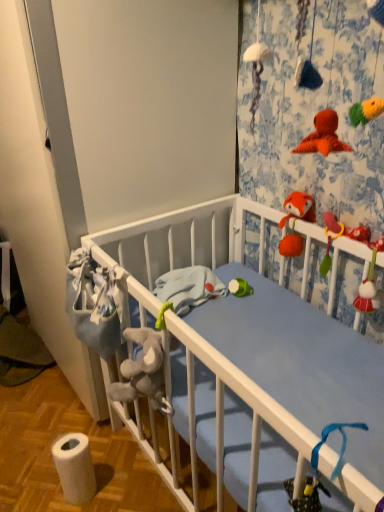
Describe the element at coordinates (298, 208) in the screenshot. Image resolution: width=384 pixels, height=512 pixels. I see `fluffy orange fox at upper right` at that location.

Where is `fluffy orange fox at upper right`? This screenshot has height=512, width=384. fluffy orange fox at upper right is located at coordinates (298, 208).

What do you see at coordinates (74, 467) in the screenshot? I see `white matte toilet paper at lower left` at bounding box center [74, 467].

This screenshot has width=384, height=512. Identify the location of white matte toilet paper at lower left. (74, 467).

Locate an element on the screen. This screenshot has height=512, width=384. fluffy orange fox at upper right is located at coordinates (298, 208).

Considering the relative positions of white matte toilet paper at lower left and fluffy orange fox at upper right in the image provided, is white matte toilet paper at lower left to the left or to the right of fluffy orange fox at upper right?

In the image, white matte toilet paper at lower left appears on the left side of fluffy orange fox at upper right.

Considering their positions, is white matte toilet paper at lower left located in front of or behind fluffy orange fox at upper right?

Visually, white matte toilet paper at lower left is located in front of fluffy orange fox at upper right.

Is point (56, 464) less distant than point (286, 236)?

Yes.

From the image's perspective, is white matte toilet paper at lower left on top of fluffy orange fox at upper right?

No.

From a real-world perspective, is white matte toilet paper at lower left under fluffy orange fox at upper right?

Indeed, from a real-world perspective, white matte toilet paper at lower left is positioned beneath fluffy orange fox at upper right.

Is white matte toilet paper at lower left thinner than fluffy orange fox at upper right?

Incorrect, the width of white matte toilet paper at lower left is not less than that of fluffy orange fox at upper right.

Which of these two, white matte toilet paper at lower left or fluffy orange fox at upper right, stands shorter?

With less height is fluffy orange fox at upper right.

Between white matte toilet paper at lower left and fluffy orange fox at upper right, which one has smaller size?

With smaller size is fluffy orange fox at upper right.

Is white matte toilet paper at lower left inside or outside of fluffy orange fox at upper right?

white matte toilet paper at lower left exists outside the volume of fluffy orange fox at upper right.

Is white matte toilet paper at lower left beside fluffy orange fox at upper right?

No, white matte toilet paper at lower left is not making contact with fluffy orange fox at upper right.

Is white matte toilet paper at lower left facing towards fluffy orange fox at upper right?

No.

Where is `toy behind the white matte toilet paper at lower left`? toy behind the white matte toilet paper at lower left is located at coordinates (298, 208).

Which is more to the right, fluffy orange fox at upper right or white matte toilet paper at lower left?

fluffy orange fox at upper right is more to the right.

From the picture: Considering the positions of objects fluffy orange fox at upper right and white matte toilet paper at lower left in the image provided, who is behind, fluffy orange fox at upper right or white matte toilet paper at lower left?

fluffy orange fox at upper right.

Considering the positions of points (313, 202) and (76, 501), is point (313, 202) closer to camera compared to point (76, 501)?

Yes.

From the image's perspective, is fluffy orange fox at upper right below white matte toilet paper at lower left?

Incorrect, from the image's perspective, fluffy orange fox at upper right is higher than white matte toilet paper at lower left.

From a real-world perspective, which object stands above the other?

From a 3D spatial view, fluffy orange fox at upper right is above.

Is fluffy orange fox at upper right thinner than white matte toilet paper at lower left?

Indeed, fluffy orange fox at upper right has a lesser width compared to white matte toilet paper at lower left.

Is fluffy orange fox at upper right shorter than white matte toilet paper at lower left?

Yes.

Can you confirm if fluffy orange fox at upper right is bigger than white matte toilet paper at lower left?

Actually, fluffy orange fox at upper right might be smaller than white matte toilet paper at lower left.

Is fluffy orange fox at upper right completely or partially outside of white matte toilet paper at lower left?

Yes, fluffy orange fox at upper right is not within white matte toilet paper at lower left.

Is fluffy orange fox at upper right far away from white matte toilet paper at lower left?

That's not correct — fluffy orange fox at upper right is a little close to white matte toilet paper at lower left.

Is white matte toilet paper at lower left at the back of fluffy orange fox at upper right?

No, fluffy orange fox at upper right is not facing away from white matte toilet paper at lower left.

How much distance is there between fluffy orange fox at upper right and white matte toilet paper at lower left?

fluffy orange fox at upper right is 36.92 inches away from white matte toilet paper at lower left.

At what (x,y) coordinates should I click in order to perform the action: click on toy behind the white matte toilet paper at lower left. Please return your answer as a coordinate pair (x, y). The width and height of the screenshot is (384, 512). Looking at the image, I should click on point(298,208).

Image resolution: width=384 pixels, height=512 pixels. I want to click on toy that appears above the white matte toilet paper at lower left (from the image's perspective), so click(298, 208).

Find the location of a particular element. The width and height of the screenshot is (384, 512). toy located behind the white matte toilet paper at lower left is located at coordinates (298, 208).